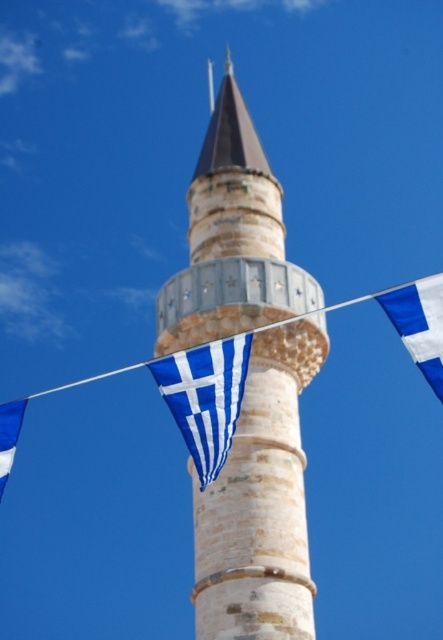
You are a photographer planning to capture the minaret and both flags in a single shot. The blue striped flag at center and the blue fabric flag at right are part of the scene. Which flag has a smaller width?

The blue striped flag at center has a smaller width than the blue fabric flag at right.

Looking at this image, you are a photographer planning to capture the minaret and the flags in the scene. You want to ensure both the blue striped flag at center and the blue fabric flag at right are clearly visible in your shot. Given their sizes, which flag should you position closer to the camera to maintain clarity?

The blue striped flag at center is smaller than the blue fabric flag at right, so to maintain clarity, you should position the blue striped flag at center closer to the camera since it is smaller and needs to be enlarged in the frame.

You are a tourist standing in front of the minaret and want to take a photo that includes both the blue striped flag at center and the blue fabric flag at lower left. Which flag will appear wider in the photo?

The blue striped flag at center will appear wider in the photo because its width surpasses that of the blue fabric flag at lower left.